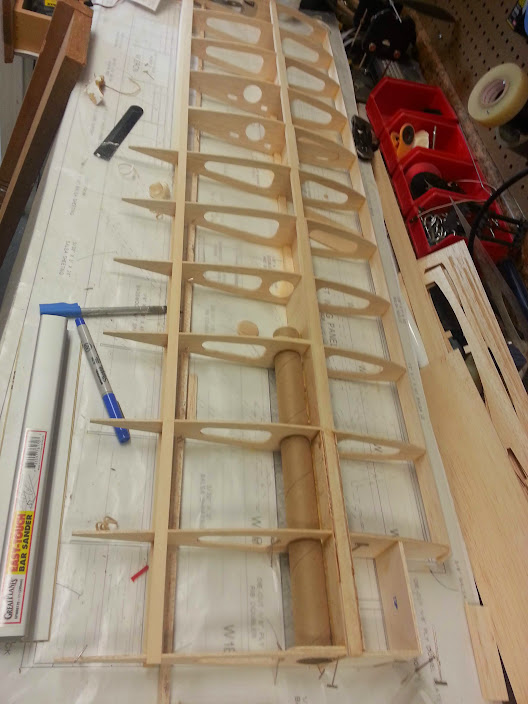
Find the location of a particular element. wood shelf that looks like a mantelpiece is located at coordinates (79, 43).